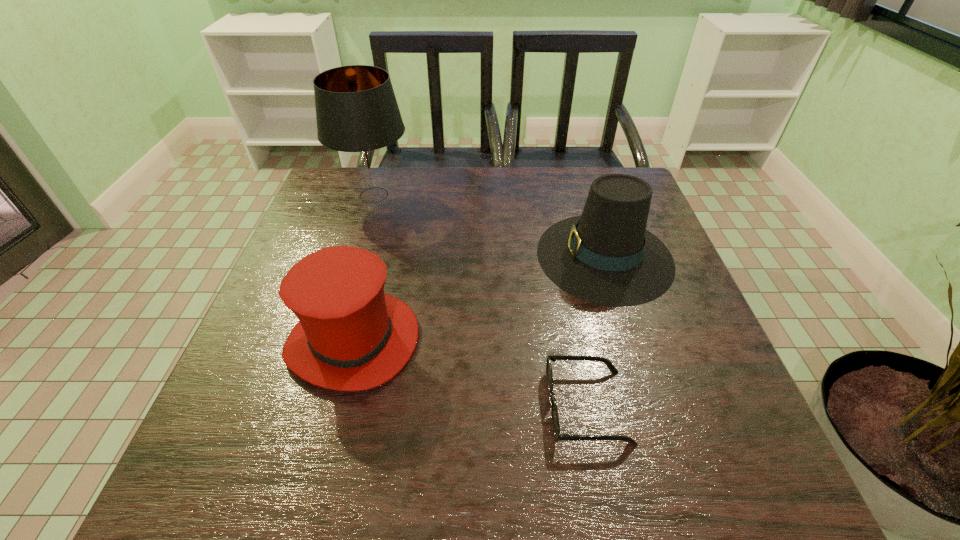
Identify the location of free space at the left edge. (244, 359).

This screenshot has height=540, width=960. In order to click on vacant space at the right edge in this screenshot , I will do `click(690, 360)`.

In the image, there is a desktop. Where is `vacant space at the far left corner`? The width and height of the screenshot is (960, 540). vacant space at the far left corner is located at coordinates (338, 179).

This screenshot has width=960, height=540. I want to click on free space at the near left corner of the desktop, so click(x=274, y=491).

Where is `free space at the near right corner`? The image size is (960, 540). free space at the near right corner is located at coordinates (722, 488).

The image size is (960, 540). In order to click on vacant area between the left hat and the sunglasses in this screenshot , I will do `click(470, 373)`.

Where is `free space between the sunglasses and the left hat`? The height and width of the screenshot is (540, 960). free space between the sunglasses and the left hat is located at coordinates (470, 373).

Identify the location of vacant space that's between the shortest object and the right hat. The width and height of the screenshot is (960, 540). (596, 331).

The image size is (960, 540). Find the location of `free space between the shortest object and the lampshade`. free space between the shortest object and the lampshade is located at coordinates (481, 301).

The height and width of the screenshot is (540, 960). I want to click on free space between the sunglasses and the left hat, so click(x=470, y=373).